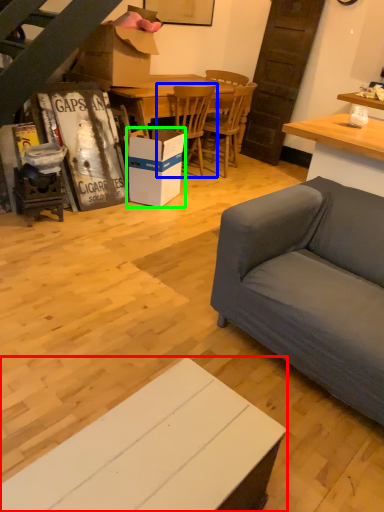
Question: Considering the real-world distances, which object is farthest from cabinetry (highlighted by a red box)? chair (highlighted by a blue box) or box (highlighted by a green box)?

Choices:
 (A) chair
 (B) box

Answer: (A)